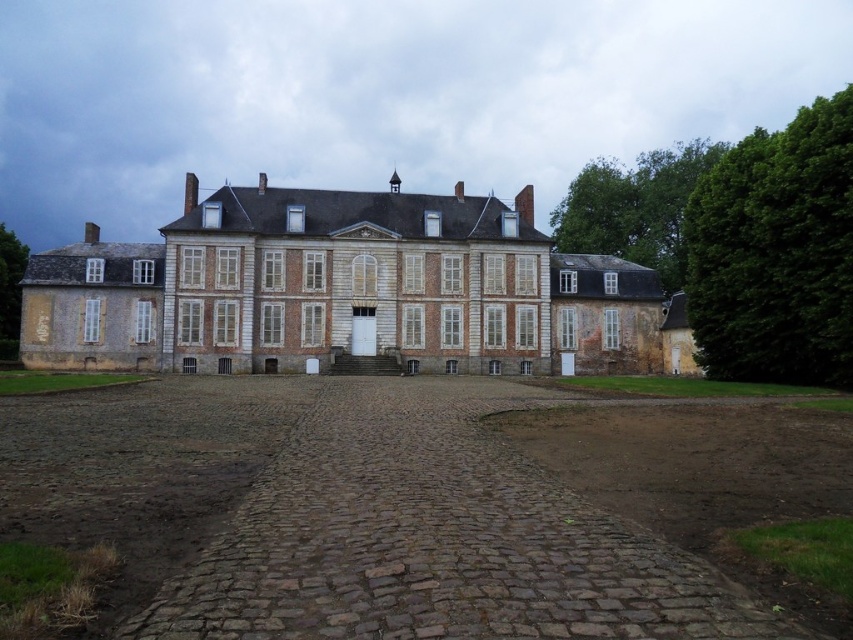
Between point (639, 564) and point (599, 176), which one is positioned behind?

Positioned behind is point (599, 176).

Is brown cobblestone driveway at center bigger than green leafy tree at upper right?

No.

Which is behind, point (122, 529) or point (561, 225)?

The point (561, 225) is more distant.

Image resolution: width=853 pixels, height=640 pixels. I want to click on brown cobblestone driveway at center, so click(343, 516).

Which is more to the left, brown cobblestone driveway at center or white brick mansion at center?

Positioned to the left is white brick mansion at center.

Can you confirm if brown cobblestone driveway at center is bigger than white brick mansion at center?

Actually, brown cobblestone driveway at center might be smaller than white brick mansion at center.

Locate an element on the screen. brown cobblestone driveway at center is located at coordinates (343, 516).

The image size is (853, 640). Identify the location of brown cobblestone driveway at center. (343, 516).

Does point (0, 516) come farther from viewer compared to point (798, 177)?

No, it is not.

Between point (62, 454) and point (799, 211), which one is positioned in front?

Point (62, 454) is more forward.

From the picture: Who is more forward, (386, 381) or (781, 173)?

Point (781, 173)

Image resolution: width=853 pixels, height=640 pixels. I want to click on brown cobblestone driveway at center, so click(343, 516).